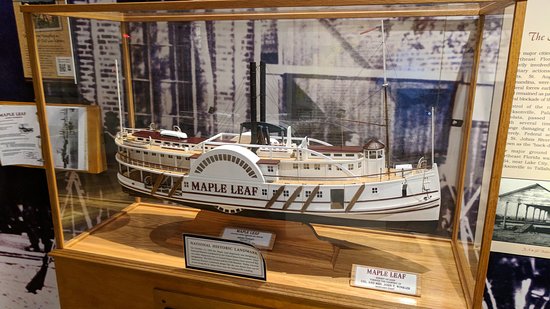
I want to click on sticker, so click(x=194, y=245).